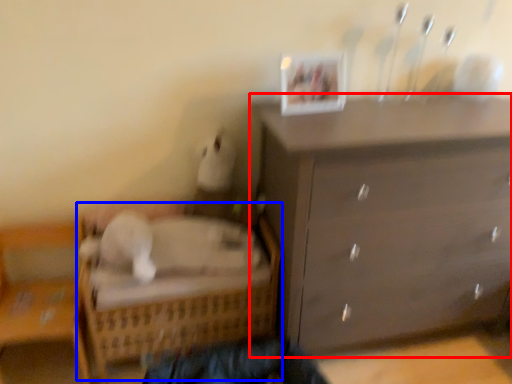
Question: Which of the following is the closest to the observer, chest of drawers (highlighted by a red box) or bed (highlighted by a blue box)?

Choices:
 (A) chest of drawers
 (B) bed

Answer: (A)